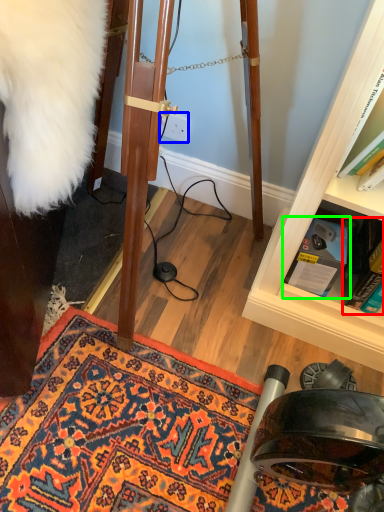
Question: Estimate the real-world distances between objects in this image. Which object is closer to book (highlighted by a red box), power outlet (highlighted by a blue box) or book (highlighted by a green box)?

Choices:
 (A) power outlet
 (B) book

Answer: (B)